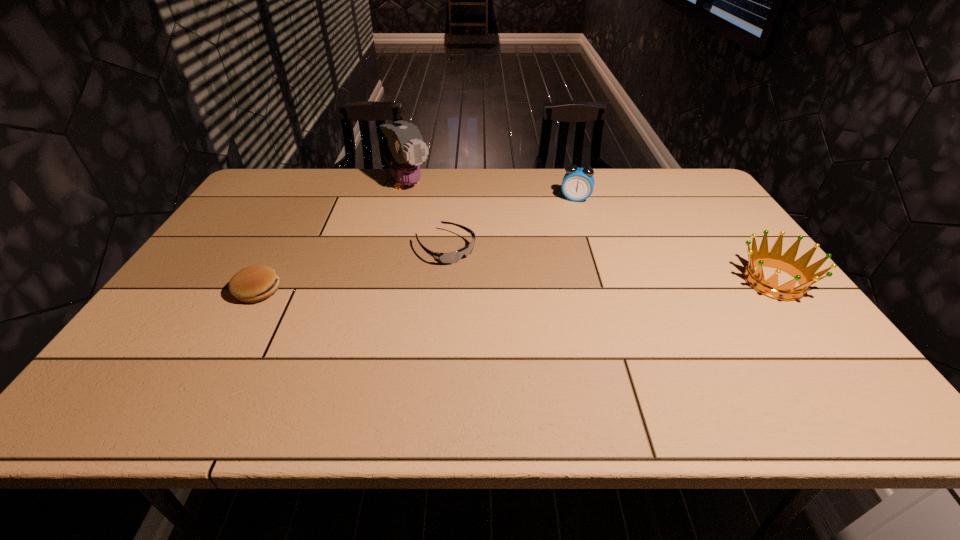
Where is `alarm clock located at the far edge`? alarm clock located at the far edge is located at coordinates (578, 183).

I want to click on object located in the left edge section of the desktop, so click(255, 283).

At what (x,y) coordinates should I click in order to perform the action: click on object present at the right edge. Please return your answer as a coordinate pair (x, y). The width and height of the screenshot is (960, 540). Looking at the image, I should click on [x=805, y=276].

Where is `free location at the far edge of the desktop`? free location at the far edge of the desktop is located at coordinates (619, 168).

The image size is (960, 540). In order to click on blank area at the near edge in this screenshot , I will do `click(551, 351)`.

Image resolution: width=960 pixels, height=540 pixels. In the image, there is a desktop. In order to click on vacant space at the right edge in this screenshot , I will do `click(785, 334)`.

At what (x,y) coordinates should I click in order to perform the action: click on free space at the far left corner. Please return your answer as a coordinate pair (x, y). The height and width of the screenshot is (540, 960). Looking at the image, I should click on (311, 168).

This screenshot has width=960, height=540. Find the location of `vacant position at the far right corner of the desktop`. vacant position at the far right corner of the desktop is located at coordinates (655, 171).

Find the location of a particular element. unoccupied position between the tallest object and the fourth tallest object is located at coordinates (332, 238).

The image size is (960, 540). I want to click on free space between the second tallest object and the crown, so click(x=675, y=240).